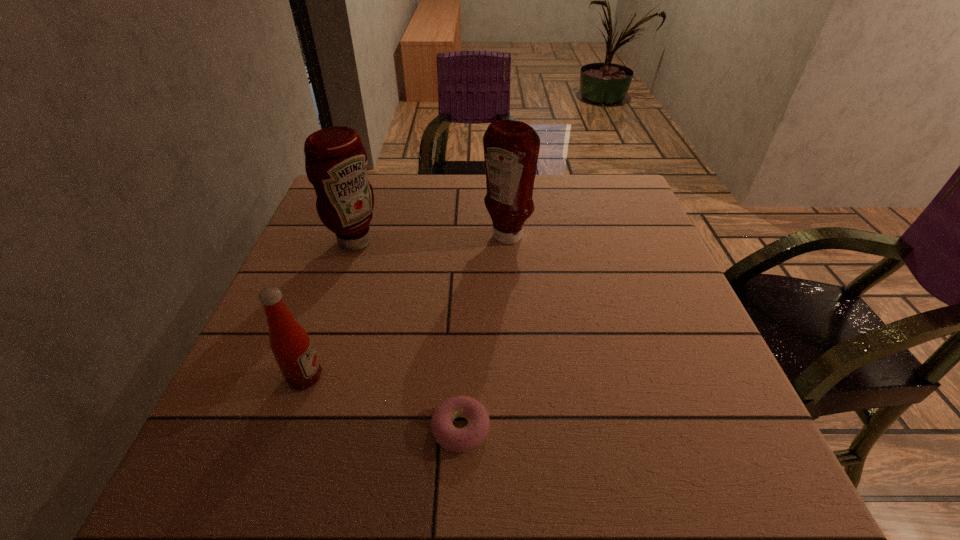
Point out which object is positioned as the third nearest to the rightmost condiment. Please provide its 2D coordinates. Your answer should be formatted as a tuple, i.e. [(x, y)], where the tuple contains the x and y coordinates of a point satisfying the conditions above.

[(289, 341)]

Locate an element on the screen. Image resolution: width=960 pixels, height=540 pixels. the closest condiment to the rightmost condiment is located at coordinates (336, 162).

At what (x,y) coordinates should I click in order to perform the action: click on condiment that is the second closest to the rightmost condiment. Please return your answer as a coordinate pair (x, y). Looking at the image, I should click on (289, 341).

This screenshot has height=540, width=960. Find the location of `free point that satisfies the following two spatial constraints: 1. on the front-facing side of the shortest object; 2. on the left side of the shortest condiment`. free point that satisfies the following two spatial constraints: 1. on the front-facing side of the shortest object; 2. on the left side of the shortest condiment is located at coordinates (287, 428).